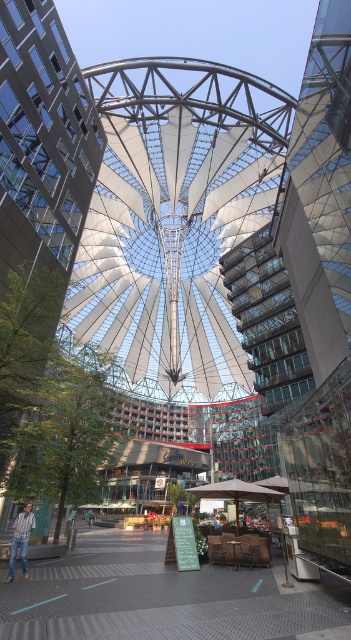
You are standing in the modern architectural space and want to take a photo of both the transparent glass tower at center and the glassy modern building at center. Which one should you position to your left to include both in the frame?

You should position the glassy modern building at center to your left because the transparent glass tower at center is to the right of it, allowing both to be captured in the frame.

You are standing at point (x=314, y=291) in the modern architectural space. What object is located exactly at your current position?

The transparent glass tower at center is located exactly at point (x=314, y=291).

You are standing at the entrance of the shopping mall and want to locate the transparent glass tower at center. According to the coordinates provided, where should you look to find it?

The transparent glass tower at center is located at point coordinates of 0.455 on the x axis and 0.895 on the y axis.